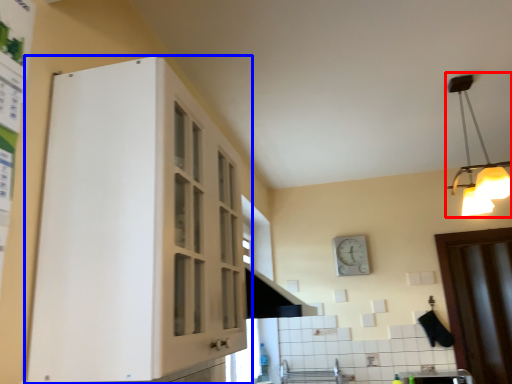
Question: Which of the following is the closest to the observer, light fixture (highlighted by a red box) or cabinetry (highlighted by a blue box)?

Choices:
 (A) light fixture
 (B) cabinetry

Answer: (B)